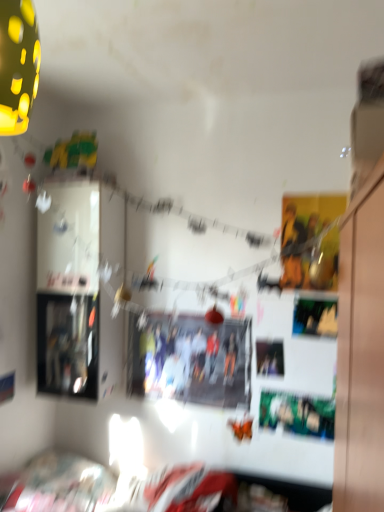
Describe the element at coordinates (193, 360) in the screenshot. I see `matte black photo frame at center` at that location.

Identify the location of matte black photo frame at center. This screenshot has width=384, height=512. (193, 360).

Where is `matte black photo frame at center`? matte black photo frame at center is located at coordinates (193, 360).